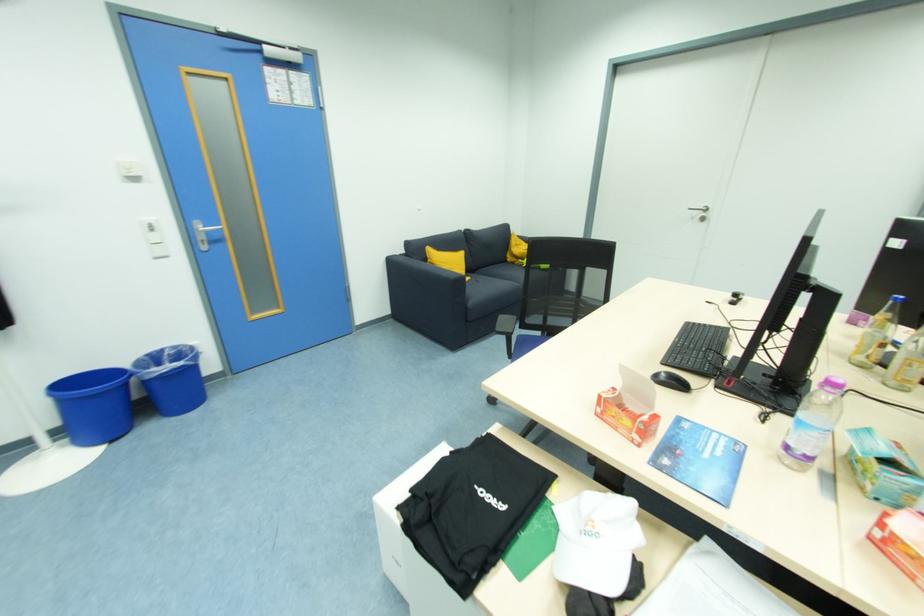
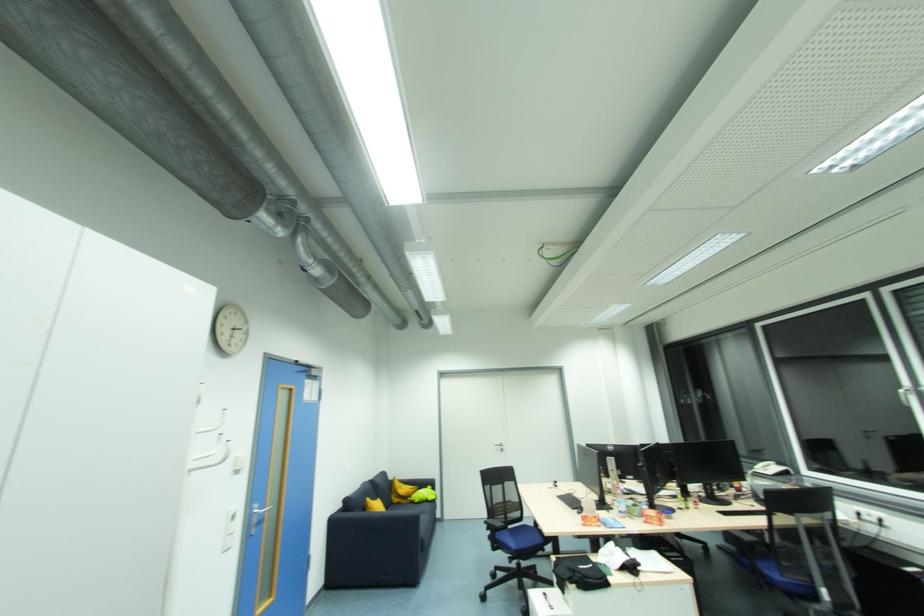
In the second image, find the point that corresponds to the point at 210,233 in the first image.

(261, 517)